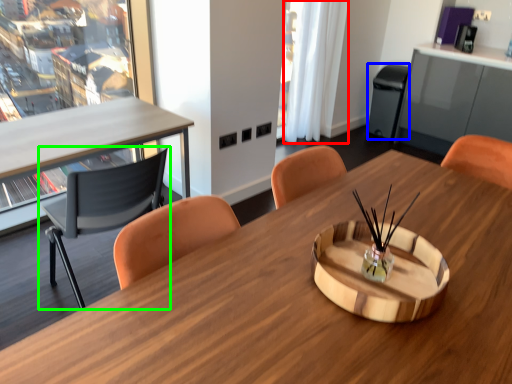
Question: Based on their relative distances, which object is nearer to curtain (highlighted by a red box)? Choose from trash bin/can (highlighted by a blue box) and chair (highlighted by a green box).

Choices:
 (A) trash bin/can
 (B) chair

Answer: (A)